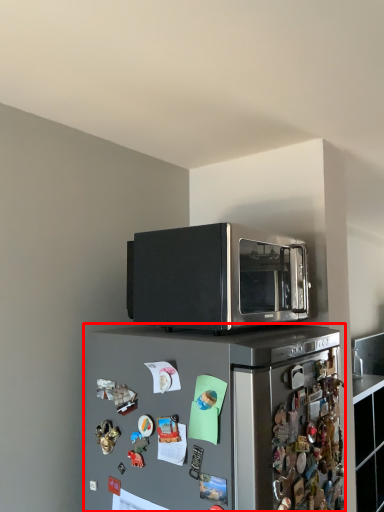
Question: Considering the relative positions of refrigerator (annotated by the red box) and microwave oven in the image provided, where is refrigerator (annotated by the red box) located with respect to the staircase?

Choices:
 (A) left
 (B) right

Answer: (A)